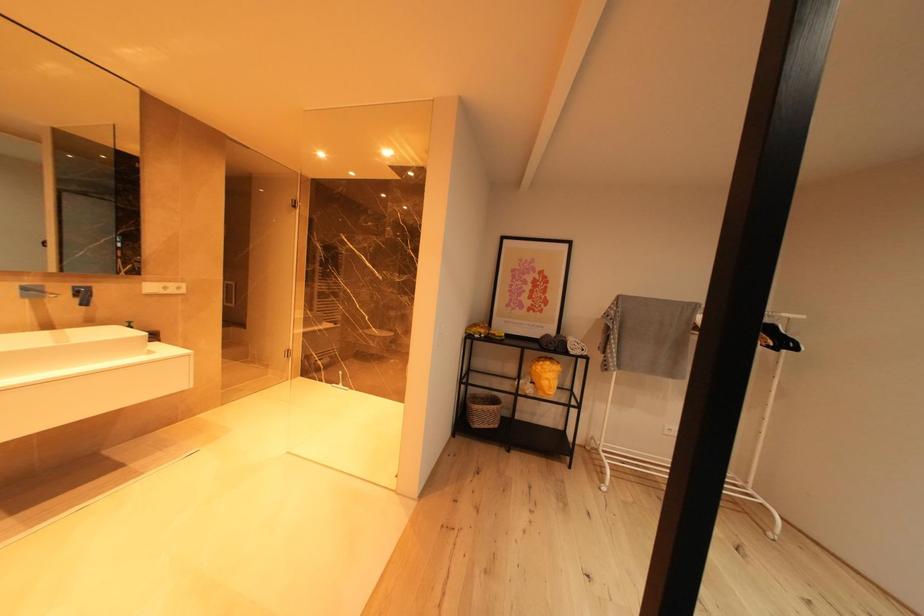
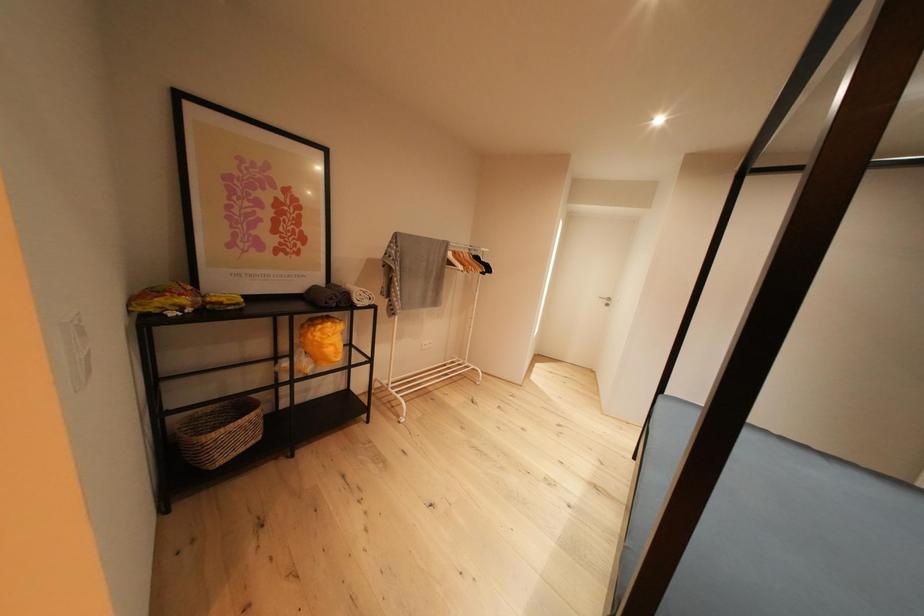
Consider the image. First-person continuous shooting, in which direction is the camera rotating?

The camera's rotation is toward right-down.